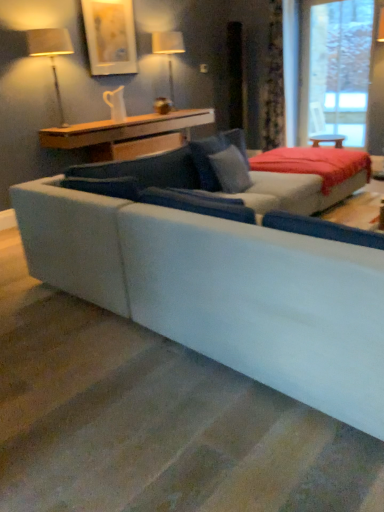
Question: In terms of height, does transparent glass window at upper right look taller or shorter compared to velvet gray bed at center?

Choices:
 (A) short
 (B) tall

Answer: (B)

Question: Is point (327, 4) closer or farther from the camera than point (342, 165)?

Choices:
 (A) closer
 (B) farther

Answer: (B)

Question: Which object is the farthest from the matte silver table lamp at upper left, which is the second table lamp in right-to-left order?

Choices:
 (A) velvet floral curtain at upper right
 (B) white fabric lampshade at upper center, which ranks as the 1th table lamp in right-to-left order
 (C) velvet gray bed at center
 (D) transparent glass window at upper right
 (E) suede gray couch at center

Answer: (D)

Question: Considering the real-world distances, which object is farthest from the suede gray couch at center?

Choices:
 (A) matte silver table lamp at upper left, which appears as the 1th table lamp when viewed from the front
 (B) wooden table at upper center
 (C) transparent glass window at upper right
 (D) white fabric lampshade at upper center, which ranks as the 1th table lamp in right-to-left order
 (E) velvet gray bed at center

Answer: (C)